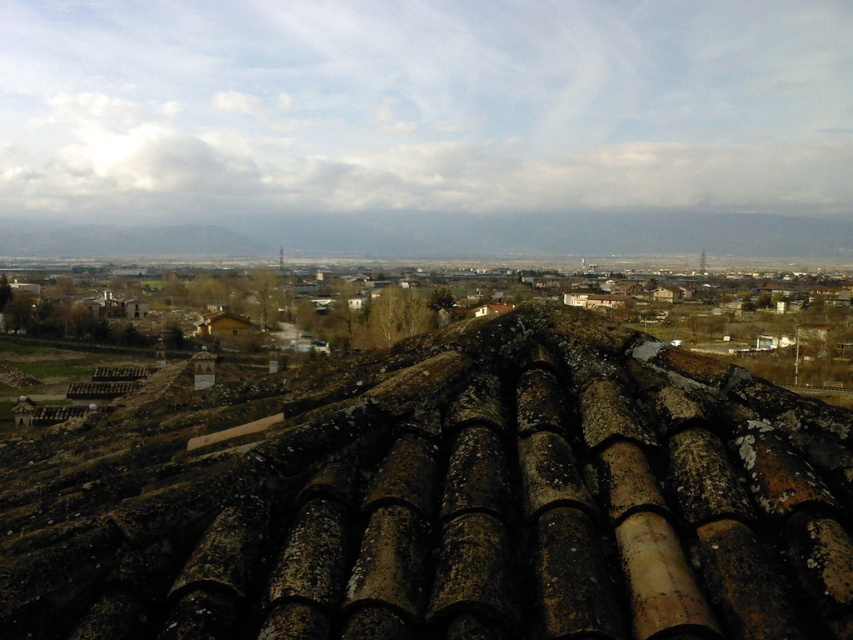
Between brown/weathered tile roof at center and brown textured building at center, which one has less height?

brown/weathered tile roof at center

Locate an element on the screen. The height and width of the screenshot is (640, 853). brown/weathered tile roof at center is located at coordinates [x=480, y=508].